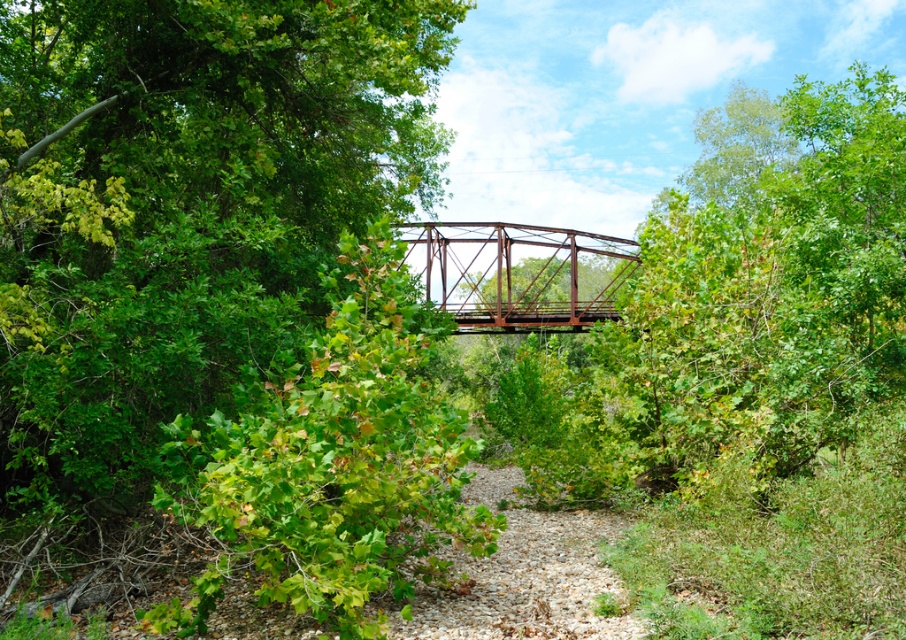
Question: Can you confirm if green leafy tree at upper left is bigger than rusty metal bridge at center?

Choices:
 (A) yes
 (B) no

Answer: (A)

Question: Which of the following is the farthest from the observer?

Choices:
 (A) rusty metal bridge at center
 (B) green leafy tree at upper left

Answer: (A)

Question: Can you confirm if green leafy tree at upper left is positioned above rusty metal bridge at center?

Choices:
 (A) no
 (B) yes

Answer: (B)

Question: Among these points, which one is nearest to the camera?

Choices:
 (A) (576, 298)
 (B) (114, 390)

Answer: (B)

Question: Is green leafy tree at upper left closer to camera compared to rusty metal bridge at center?

Choices:
 (A) yes
 (B) no

Answer: (A)